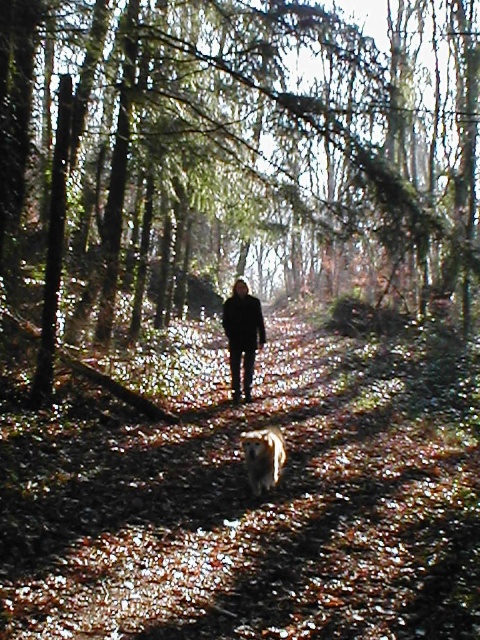
Question: Which object appears farthest from the camera in this image?

Choices:
 (A) green leafy tree at center
 (B) dark matte coat at center
 (C) golden fur dog at center
 (D) brown leafy forest path at center

Answer: (B)

Question: Which point is closer to the camera?

Choices:
 (A) (237, 380)
 (B) (285, 241)
 (C) (268, 456)
 (D) (364, 344)

Answer: (C)

Question: Is brown leafy forest path at center bigger than golden fur dog at center?

Choices:
 (A) no
 (B) yes

Answer: (B)

Question: Can you confirm if dark matte coat at center is smaller than golden fur dog at center?

Choices:
 (A) no
 (B) yes

Answer: (B)

Question: Does dark matte coat at center appear under golden fur dog at center?

Choices:
 (A) no
 (B) yes

Answer: (A)

Question: Among these points, which one is nearest to the camera?

Choices:
 (A) (248, 323)
 (B) (313, 376)
 (C) (243, 451)
 (D) (43, 317)

Answer: (C)